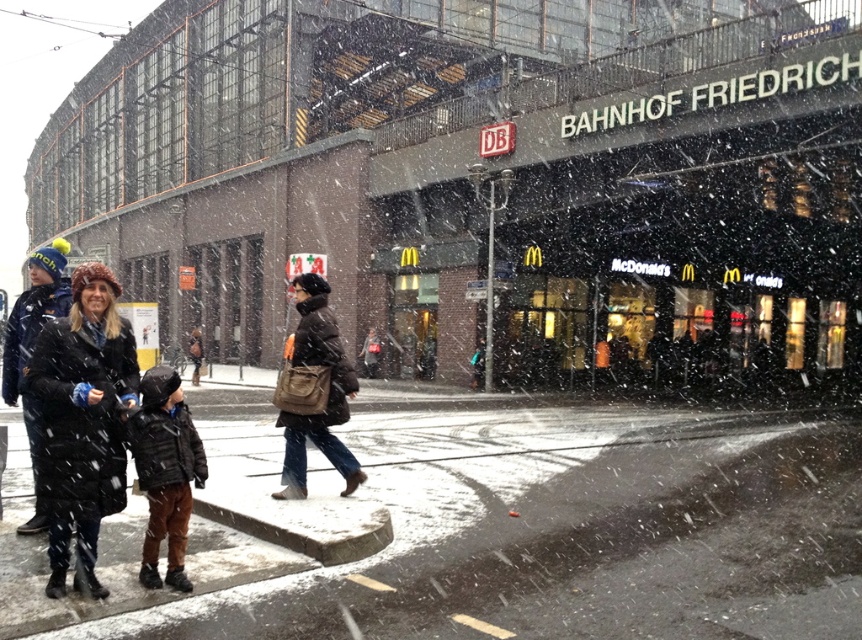
Can you confirm if smooth concrete sidewalk at center is thinner than dark brown leather jacket at lower left?

In fact, smooth concrete sidewalk at center might be wider than dark brown leather jacket at lower left.

The width and height of the screenshot is (862, 640). I want to click on smooth concrete sidewalk at center, so click(490, 529).

Who is positioned more to the right, black puffy coat at center or dark brown leather jacket at center?

dark brown leather jacket at center is more to the right.

Is black puffy coat at center smaller than dark brown leather jacket at center?

Yes.

Image resolution: width=862 pixels, height=640 pixels. Find the location of `black puffy coat at center`. black puffy coat at center is located at coordinates (80, 420).

Which of these two, smooth concrete sidewalk at center or dark brown leather jacket at center, stands taller?

smooth concrete sidewalk at center is taller.

Who is lower down, smooth concrete sidewalk at center or dark brown leather jacket at center?

smooth concrete sidewalk at center is lower down.

Which is in front, point (498, 561) or point (335, 380)?

Positioned in front is point (498, 561).

Identify the location of smooth concrete sidewalk at center. The width and height of the screenshot is (862, 640). (490, 529).